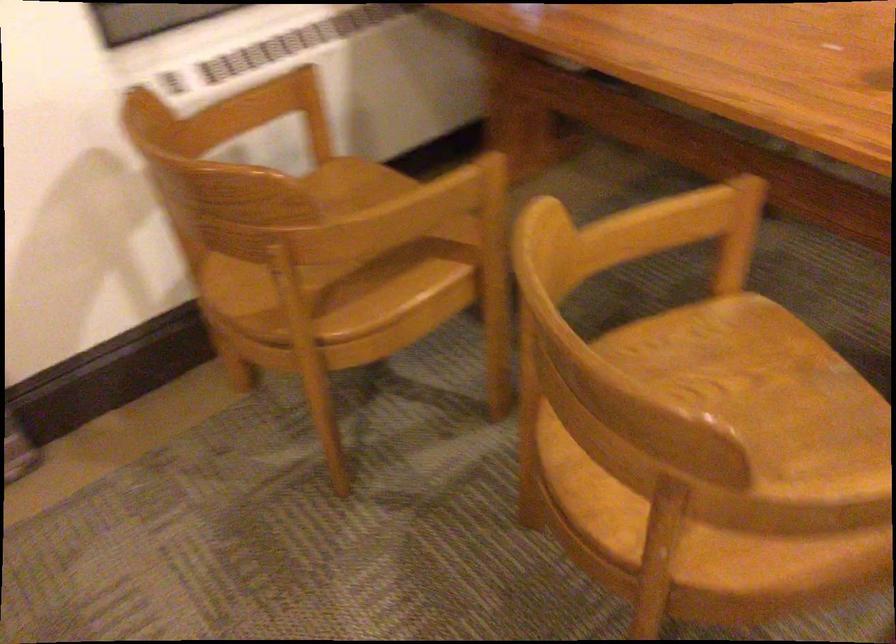
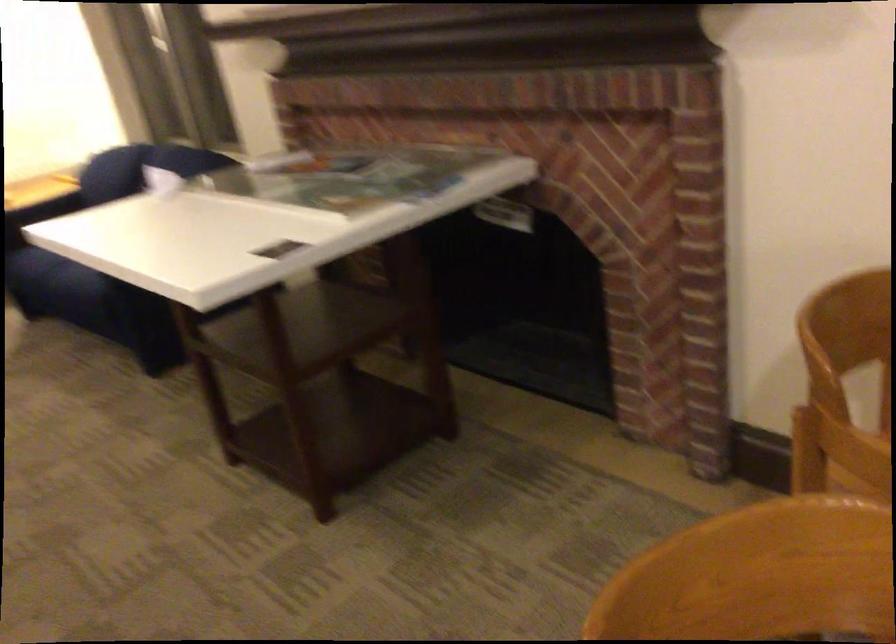
First-person continuous shooting, in which direction is the camera rotating?

The camera's rotation is toward left-down.